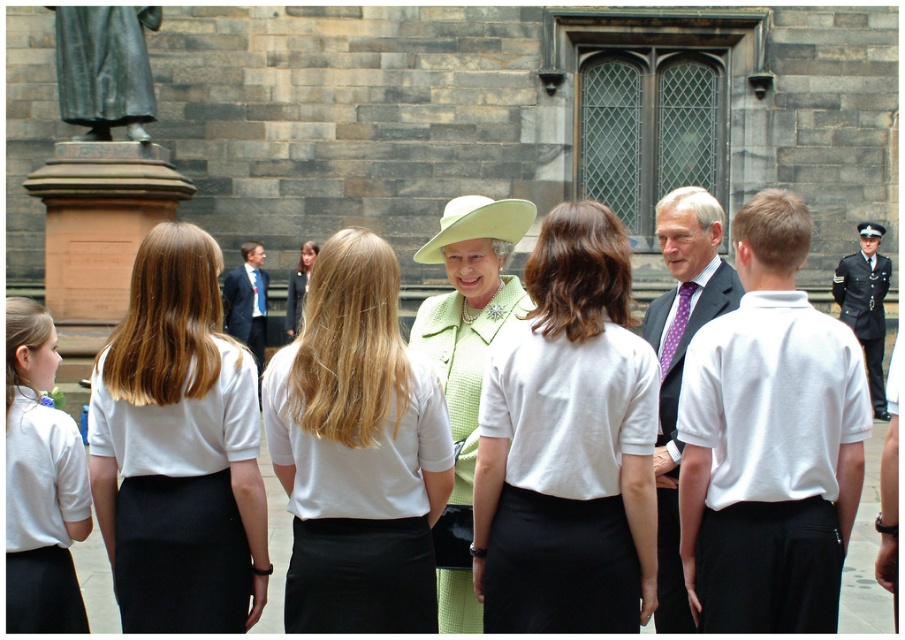
Measure the distance between white fabric shirt at left and camera.

They are 28.49 meters apart.

Does white fabric shirt at left have a lesser width compared to white fabric uniform at center?

Yes, white fabric shirt at left is thinner than white fabric uniform at center.

The image size is (905, 640). In order to click on white fabric shirt at left in this screenshot , I will do `click(40, 483)`.

Is light green fabric dress at center smaller than bronze statue at left?

No, light green fabric dress at center is not smaller than bronze statue at left.

Is light green fabric dress at center shorter than bronze statue at left?

No, light green fabric dress at center is not shorter than bronze statue at left.

Who is more distant from viewer, (621, 289) or (84, 36)?

The point (84, 36) is more distant.

Locate an element on the screen. light green fabric dress at center is located at coordinates (568, 444).

Is white fabric shirt at center positioned behind dark blue uniform at right?

No, it is not.

The width and height of the screenshot is (905, 640). I want to click on white fabric shirt at center, so click(178, 449).